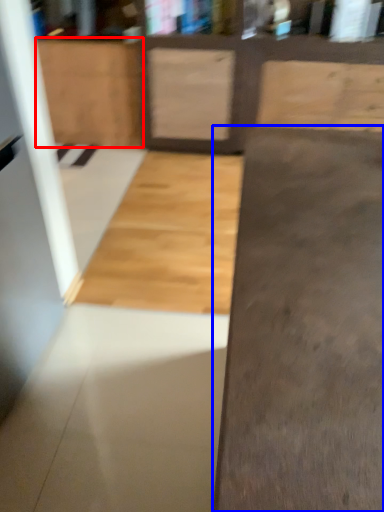
Question: Which object appears closest to the camera in this image, cabinetry (highlighted by a red box) or concrete (highlighted by a blue box)?

Choices:
 (A) cabinetry
 (B) concrete

Answer: (B)